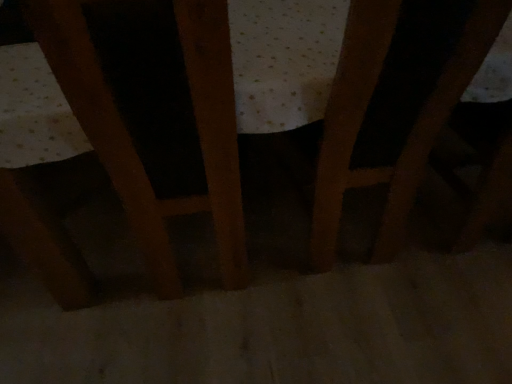
Locate an element on the screen. The width and height of the screenshot is (512, 384). vacant area that lies in front of wooden chair at center is located at coordinates (210, 345).